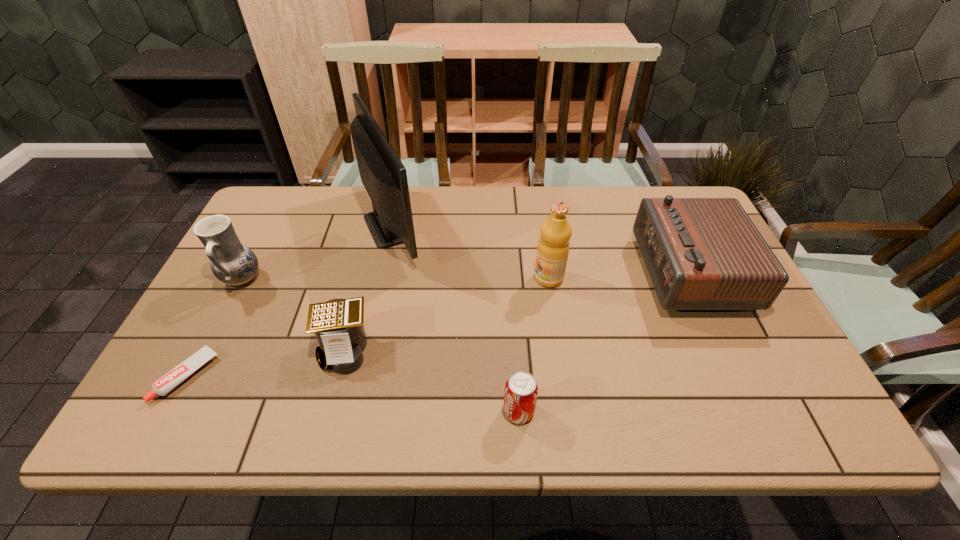
You are a GUI agent. You are given a task and a screenshot of the screen. Output one action in this format:
    pyautogui.click(x=<x>, y=<y>)
    Task: Click on the radio receiver situated at the far edge
    
    Given the screenshot: What is the action you would take?
    pyautogui.click(x=701, y=253)

Identify the location of soda that is at the near edge. The image size is (960, 540). (521, 390).

In order to click on toothpaste that is positioned at the near edge in this screenshot , I will do `click(173, 378)`.

Find the location of a particular element. Image resolution: width=960 pixels, height=540 pixels. pottery that is at the left edge is located at coordinates (233, 263).

Identify the location of toothpaste located in the left edge section of the desktop. Image resolution: width=960 pixels, height=540 pixels. (173, 378).

Locate an element on the screen. The image size is (960, 540). object present at the right edge is located at coordinates (701, 253).

Find the location of `object that is positioned at the near left corner`. object that is positioned at the near left corner is located at coordinates (173, 378).

Where is `object located in the far right corner section of the desktop`? The width and height of the screenshot is (960, 540). object located in the far right corner section of the desktop is located at coordinates (701, 253).

I want to click on vacant space at the far edge, so point(510,232).

The height and width of the screenshot is (540, 960). In order to click on free region at the left edge in this screenshot , I will do `click(211, 296)`.